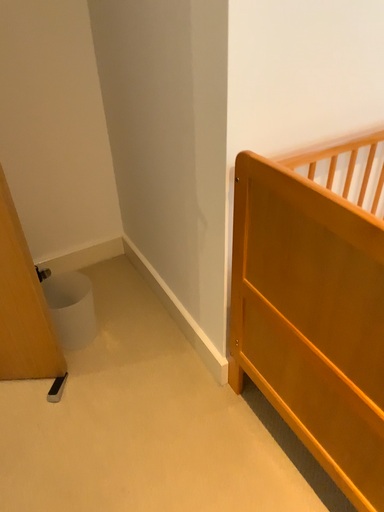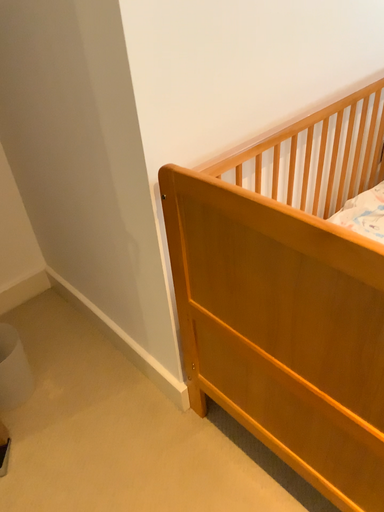
Question: Which way did the camera rotate in the video?

Choices:
 (A) rotated left
 (B) rotated right

Answer: (B)